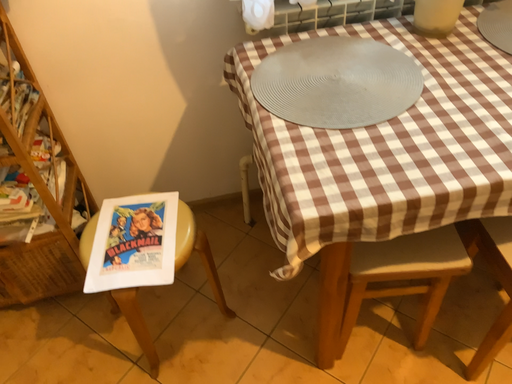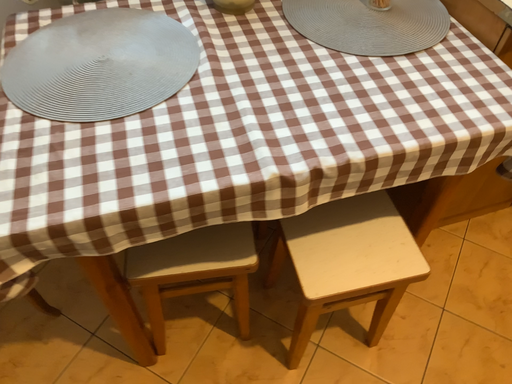
Question: How did the camera likely rotate when shooting the video?

Choices:
 (A) rotated left
 (B) rotated right

Answer: (B)